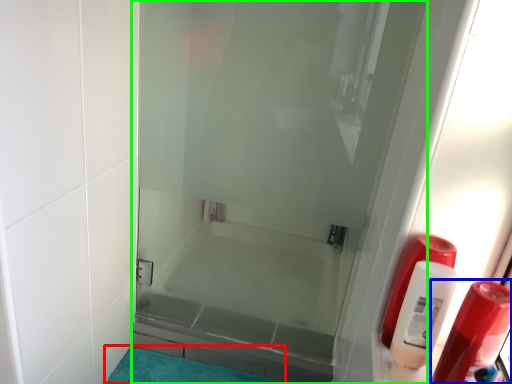
Question: Estimate the real-world distances between objects in this image. Which object is closer to bath mat (highlighted by a red box), soap dispenser (highlighted by a blue box) or door (highlighted by a green box)?

Choices:
 (A) soap dispenser
 (B) door

Answer: (B)